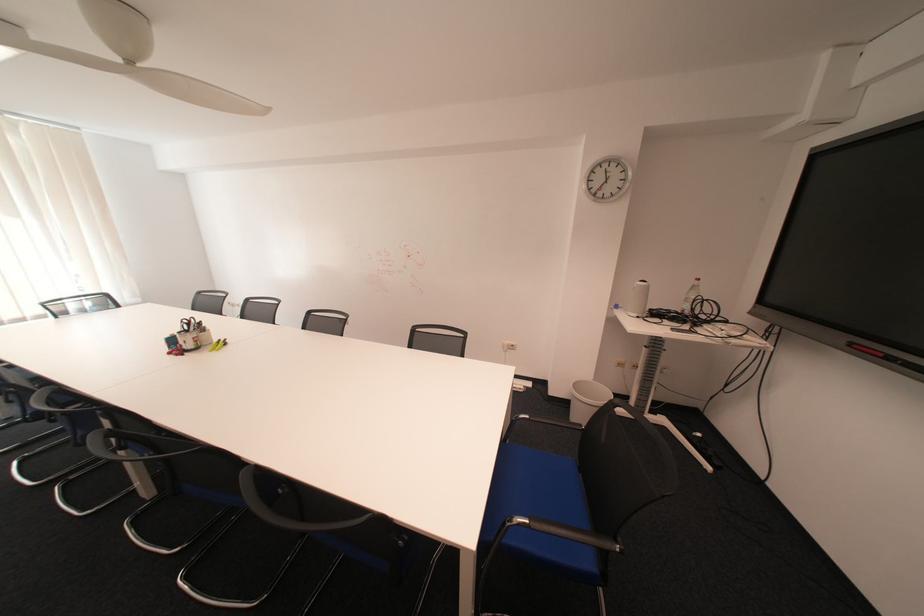
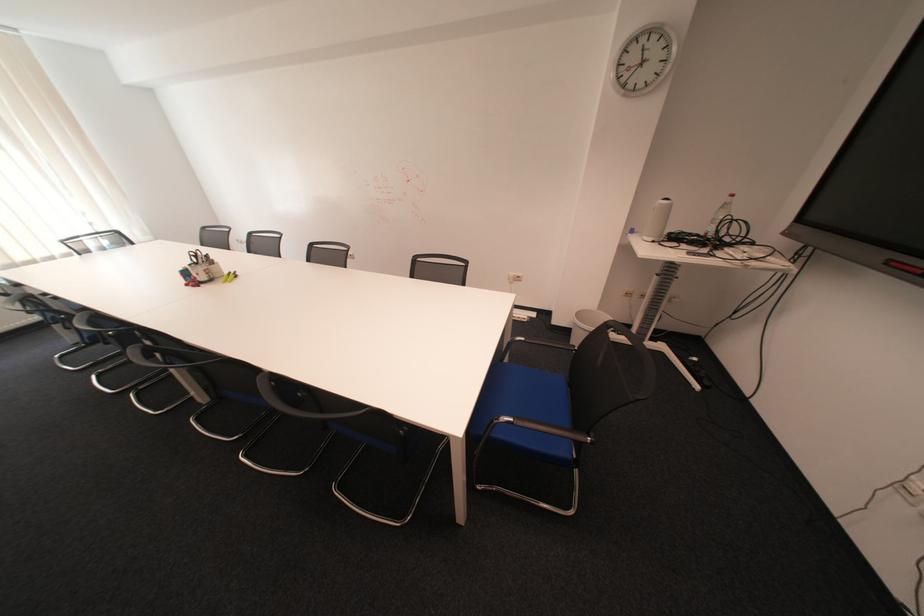
Where in the second image is the point corresponding to pixel 690 307 from the first image?

(714, 229)